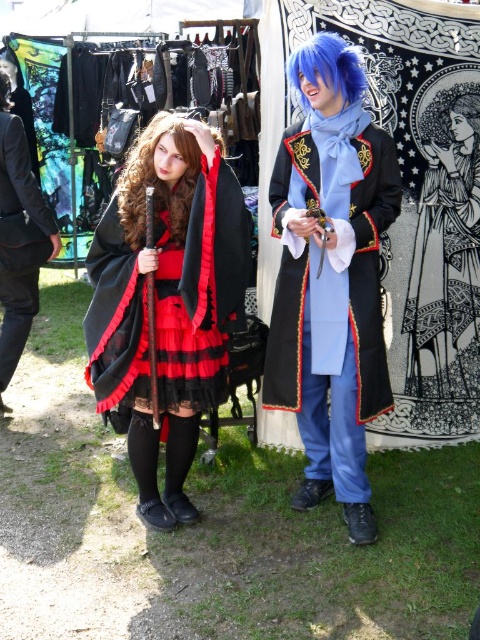
Question: Based on their relative distances, which object is farther from the velvet black cape at center?

Choices:
 (A) blonde silk hair at upper right
 (B) black leather jacket at center
 (C) blue velvet coat at center
 (D) black velvet dress at center

Answer: (A)

Question: Can you confirm if dark brown silky hair at center is bigger than brown silky hair at upper center?

Choices:
 (A) yes
 (B) no

Answer: (A)

Question: Which object is closer to the camera taking this photo?

Choices:
 (A) brown silky hair at upper center
 (B) black velvet dress at center

Answer: (B)

Question: Which object is positioned closest to the blue velvet coat at center?

Choices:
 (A) blue synthetic wig at upper center
 (B) dark brown silky hair at center
 (C) black leather jacket at center
 (D) blonde silk hair at upper right

Answer: (A)

Question: Can you confirm if blue synthetic wig at upper center is positioned to the right of brown silky hair at upper center?

Choices:
 (A) no
 (B) yes

Answer: (B)

Question: Can you confirm if black leather jacket at center is wider than blue synthetic wig at upper center?

Choices:
 (A) no
 (B) yes

Answer: (B)